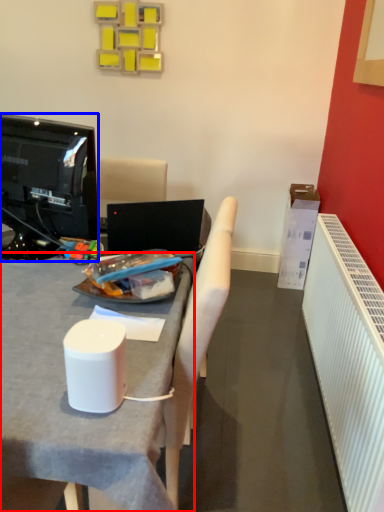
Question: Which object is closer to the camera taking this photo, desk (highlighted by a red box) or television (highlighted by a blue box)?

Choices:
 (A) desk
 (B) television

Answer: (A)